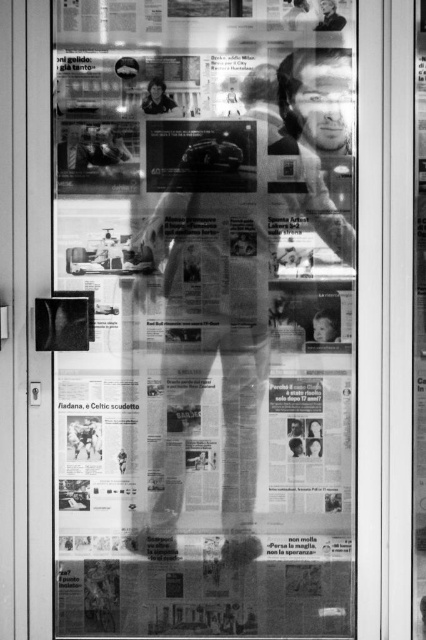
Does printed paper poster at center appear under smooth skin person at upper center?

Indeed, printed paper poster at center is positioned under smooth skin person at upper center.

Who is taller, printed paper poster at center or smooth skin person at upper center?

With more height is printed paper poster at center.

Where is `printed paper poster at center`? The image size is (426, 640). printed paper poster at center is located at coordinates click(206, 317).